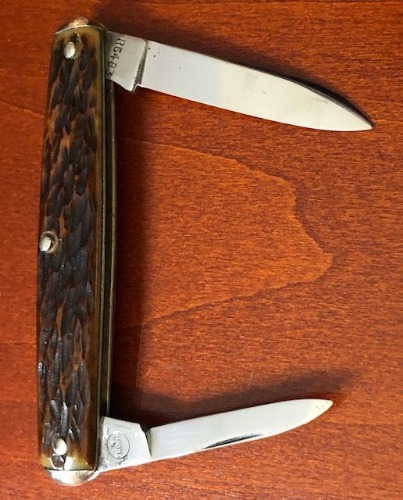
Locate an element on the screen. This screenshot has width=403, height=500. knife handle is located at coordinates (92, 105).